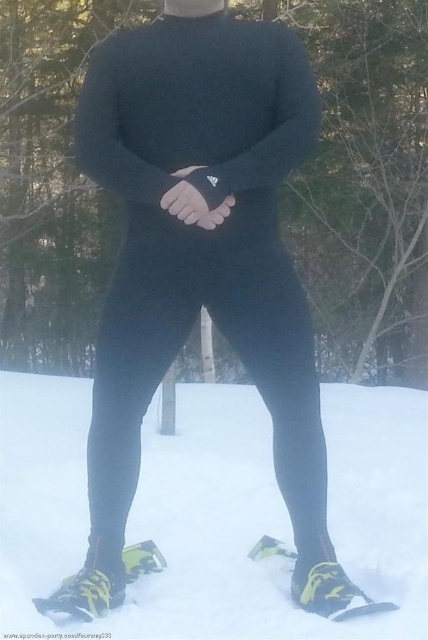
You are trying to locate the point marked at coordinates (x=214, y=509) in the image. Based on the scene description, where would this point be located?

The point at coordinates (x=214, y=509) is located on the yellow and black running shoes, as they are the only footwear visible in the snowy environment described.